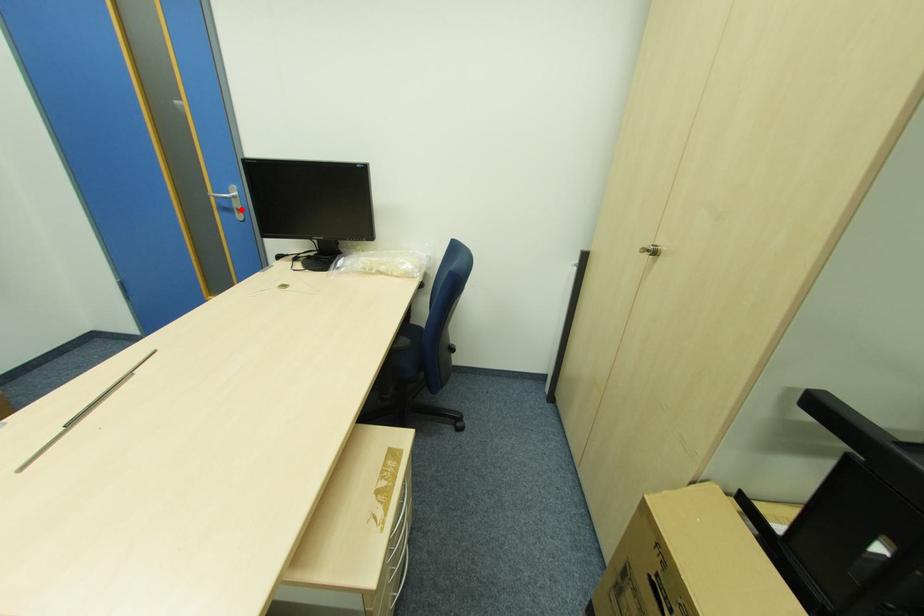
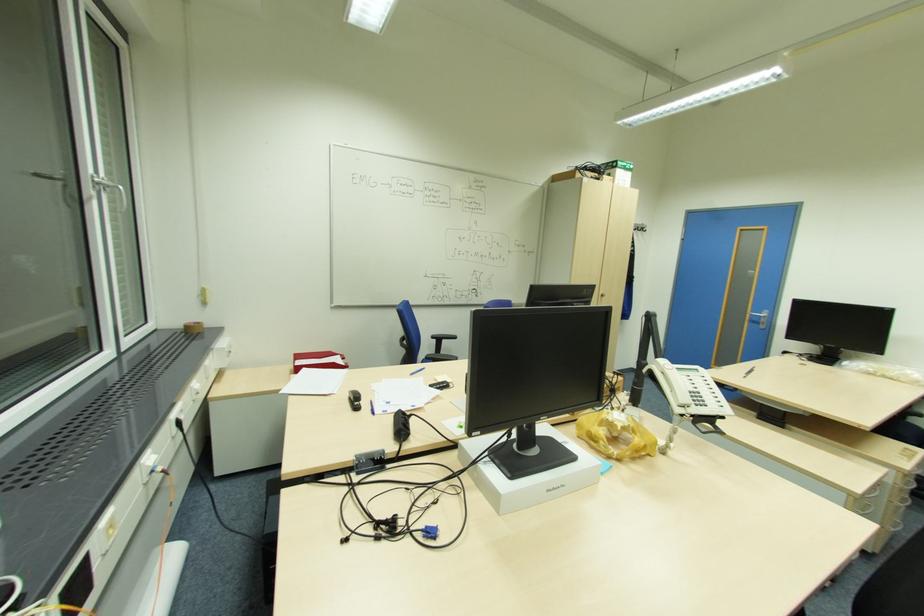
Locate, in the second image, the point that corresponds to the highlighted location in the first image.

(766, 323)